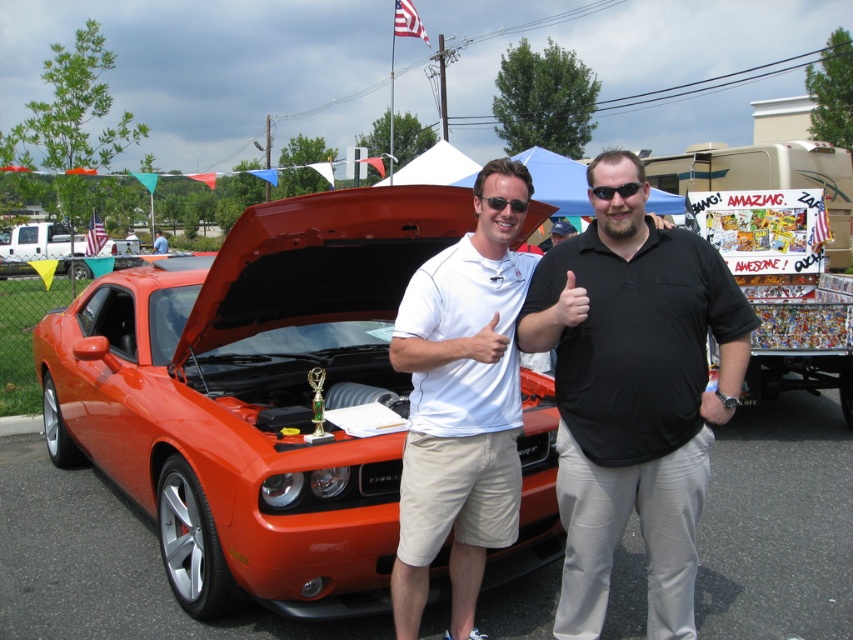
You are trying to take a photo of the orange matte car at center and the matte white shirt at center. Which object is wider in the scene?

The orange matte car at center is wider than the matte white shirt at center according to the description.

You are a photographer at the car show and want to take a picture of the orange matte car at center and the white cotton polo shirt at center. Which object is positioned higher in the frame?

The orange matte car at center is above the white cotton polo shirt at center, so it is positioned higher in the frame.

You are a photographer at the car show and want to take a photo of the orange matte car at center and the white cotton polo shirt at center. The minimum distance required for your camera to focus properly is 4 feet. Will the camera be able to focus on both subjects clearly?

The orange matte car at center is 3.59 feet from the white cotton polo shirt at center. Since the minimum focusing distance required is 4 feet, the camera cannot focus on both subjects clearly as they are too close together.